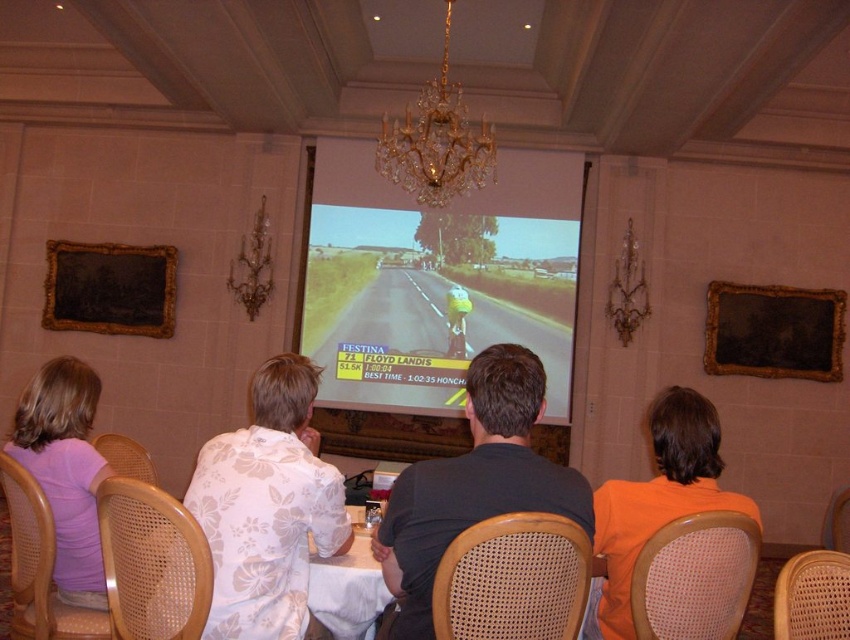
Question: Which point is farther from the camera taking this photo?

Choices:
 (A) (148, 252)
 (B) (403, 252)
 (C) (208, 634)
 (D) (60, 576)

Answer: (A)

Question: Which point is closer to the camera?

Choices:
 (A) orange t-shirt at lower right
 (B) matte pink shirt at left
 (C) white woven table at center
 (D) gold-framed picture at upper left

Answer: (A)

Question: Does gold-framed picture at upper left have a smaller size compared to gold crystal chandelier at upper center?

Choices:
 (A) yes
 (B) no

Answer: (A)

Question: Does white cloth table at lower center appear over white woven table at center?

Choices:
 (A) no
 (B) yes

Answer: (A)

Question: Can you confirm if white floral shirt at center is wider than gold crystal chandelier at upper center?

Choices:
 (A) no
 (B) yes

Answer: (A)

Question: Which object is farther from the camera taking this photo?

Choices:
 (A) matte pink shirt at left
 (B) gold crystal chandelier at upper center
 (C) matte screen at center

Answer: (C)